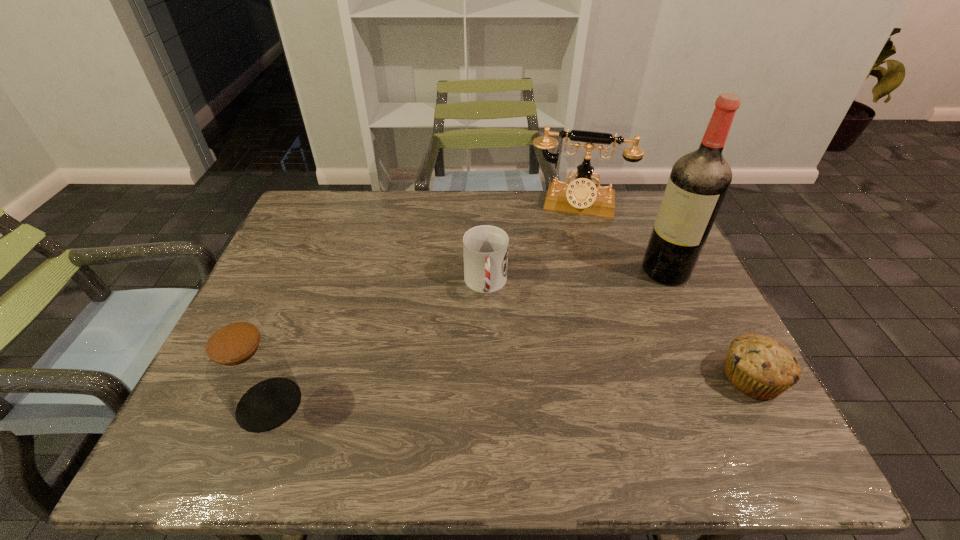
This screenshot has width=960, height=540. Identify the location of vacant space in between the telephone and the fourth object from right to left. (532, 244).

This screenshot has width=960, height=540. I want to click on free space between the fourth object from right to left and the jar, so (377, 344).

This screenshot has height=540, width=960. What are the coordinates of `vacant area that lies between the muffin and the jar` in the screenshot? It's located at (511, 391).

Identify the location of free space between the jar and the liquor. This screenshot has width=960, height=540. (468, 338).

Where is `object that is the fourth closest to the liquor`? The image size is (960, 540). object that is the fourth closest to the liquor is located at coordinates (248, 370).

Where is `the second closest object to the cup`? This screenshot has height=540, width=960. the second closest object to the cup is located at coordinates (698, 183).

I want to click on vacant point that satisfies the following two spatial constraints: 1. on the front side of the muffin; 2. on the left side of the cup, so tap(487, 378).

This screenshot has height=540, width=960. In order to click on free spot that satisfies the following two spatial constraints: 1. on the back side of the fourth object from right to left; 2. on the left side of the third shortest object in this screenshot , I will do `click(316, 285)`.

Where is `blank area in the image that satisfies the following two spatial constraints: 1. on the back side of the telephone; 2. on the right side of the fourth object from right to left`? The width and height of the screenshot is (960, 540). blank area in the image that satisfies the following two spatial constraints: 1. on the back side of the telephone; 2. on the right side of the fourth object from right to left is located at coordinates (485, 204).

This screenshot has height=540, width=960. What are the coordinates of `free space that satisfies the following two spatial constraints: 1. on the front side of the muffin; 2. on the right side of the second tallest object` in the screenshot? It's located at (627, 378).